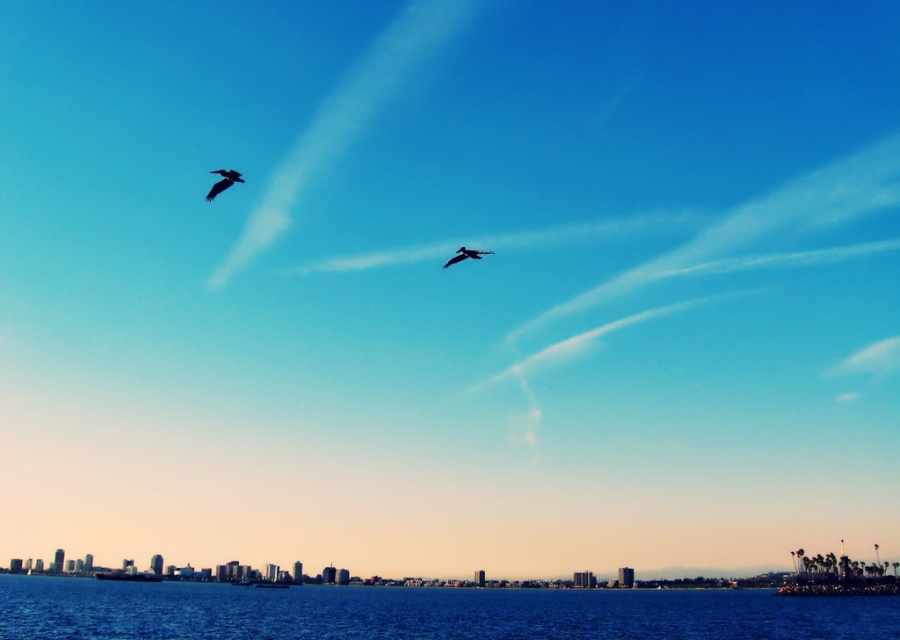
Looking at this image, you are a birdwatcher standing on the coast and see the silhouette feathered bird at upper left. Where exactly is the bird located in the image?

The silhouette feathered bird at upper left is located at point (223, 180).